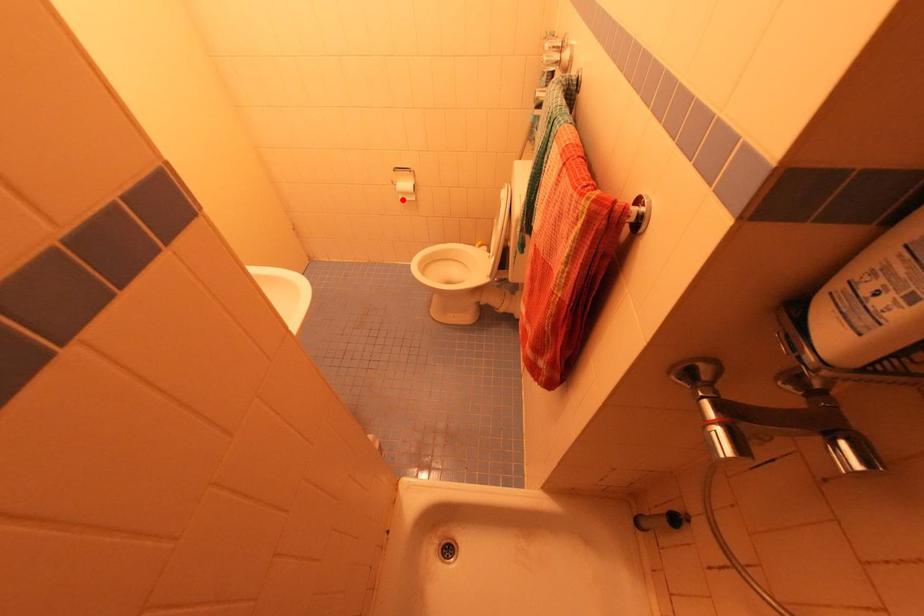
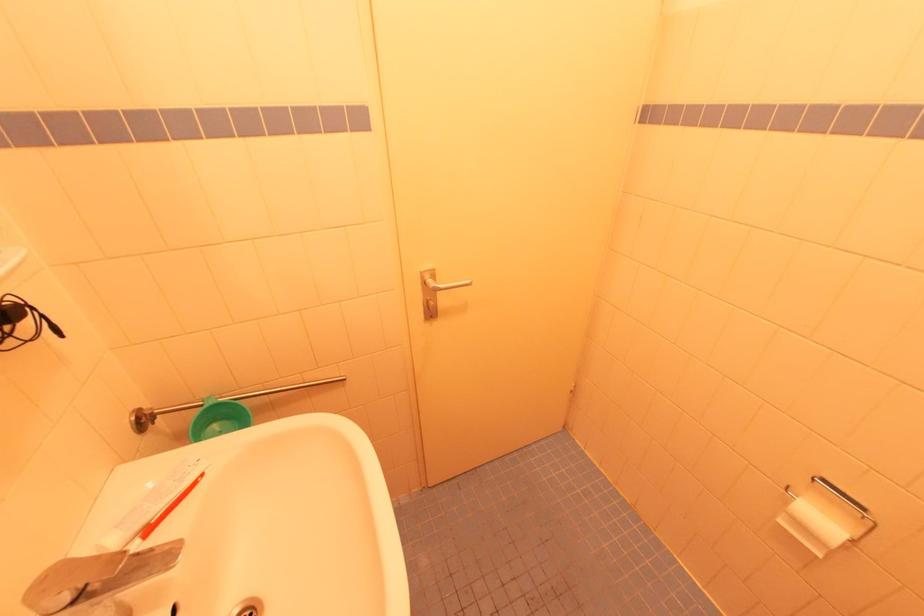
Locate, in the second image, the point that corresponds to the highlighted location in the first image.

(784, 523)